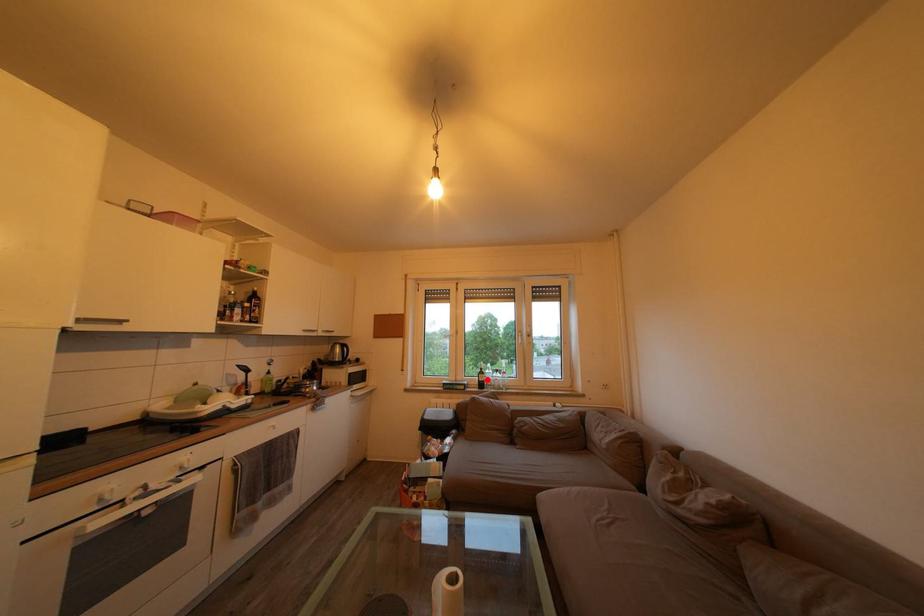
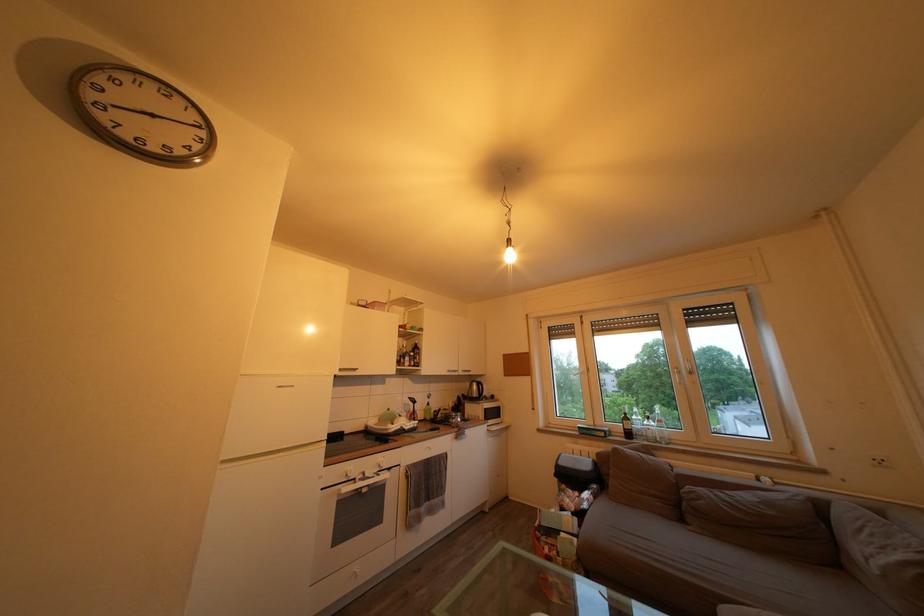
Question: I am providing you with two images of the same scene from different viewpoints. A red point is marked on the first image. Is the red point's position out of view in image 2?

Choices:
 (A) Yes
 (B) No

Answer: (B)